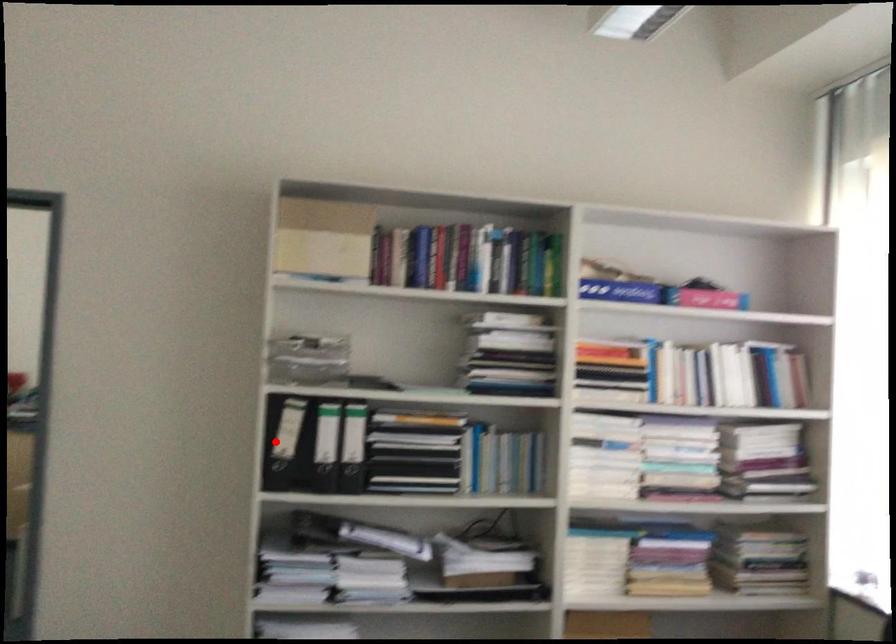
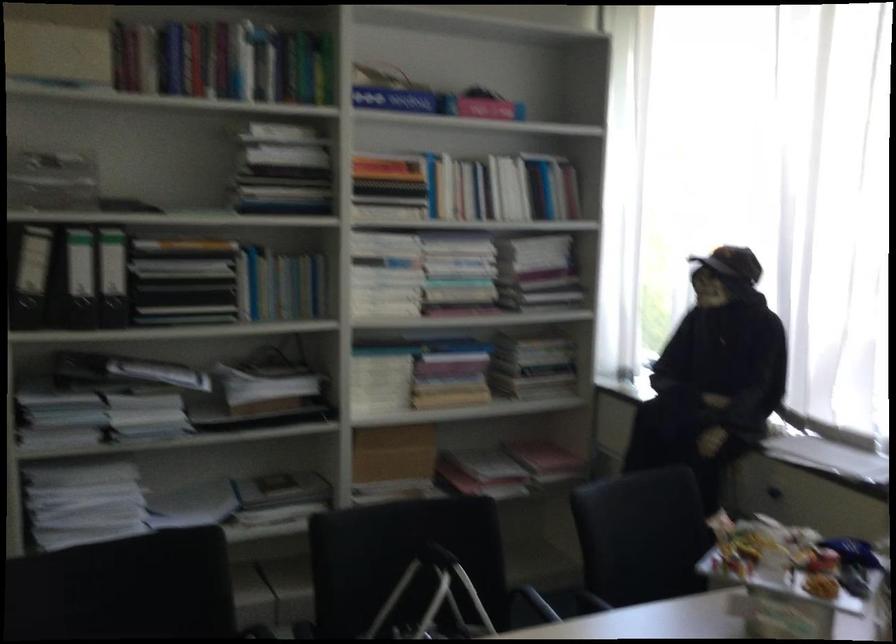
Locate, in the second image, the point that corresponds to the highlighted location in the first image.

(29, 274)